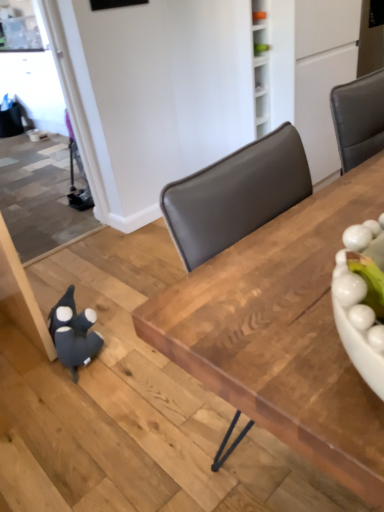
Question: Is velvety dark blue plush toy at lower left spatially inside wooden table at center, or outside of it?

Choices:
 (A) outside
 (B) inside

Answer: (A)

Question: Is point (69, 325) positioned closer to the camera than point (296, 283)?

Choices:
 (A) farther
 (B) closer

Answer: (A)

Question: From the image's perspective, is velvety dark blue plush toy at lower left located above or below wooden table at center?

Choices:
 (A) above
 (B) below

Answer: (B)

Question: Considering their positions, is wooden table at center located in front of or behind velvety dark blue plush toy at lower left?

Choices:
 (A) behind
 (B) front

Answer: (B)

Question: Does point (278, 295) appear closer or farther from the camera than point (54, 324)?

Choices:
 (A) closer
 (B) farther

Answer: (A)

Question: Is wooden table at center situated inside velvety dark blue plush toy at lower left or outside?

Choices:
 (A) outside
 (B) inside

Answer: (A)

Question: From a real-world perspective, relative to velvety dark blue plush toy at lower left, is wooden table at center vertically above or below?

Choices:
 (A) above
 (B) below

Answer: (A)